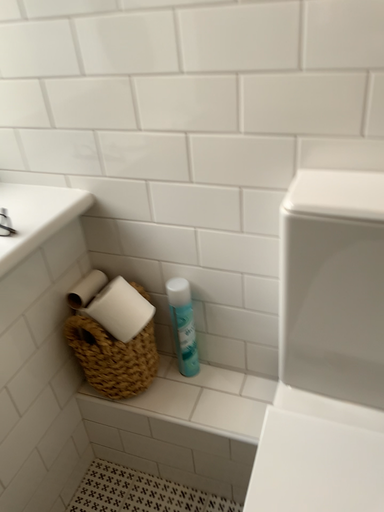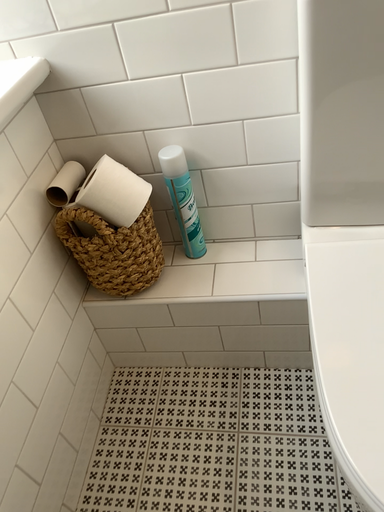
Question: How did the camera likely rotate when shooting the video?

Choices:
 (A) rotated upward
 (B) rotated downward

Answer: (B)